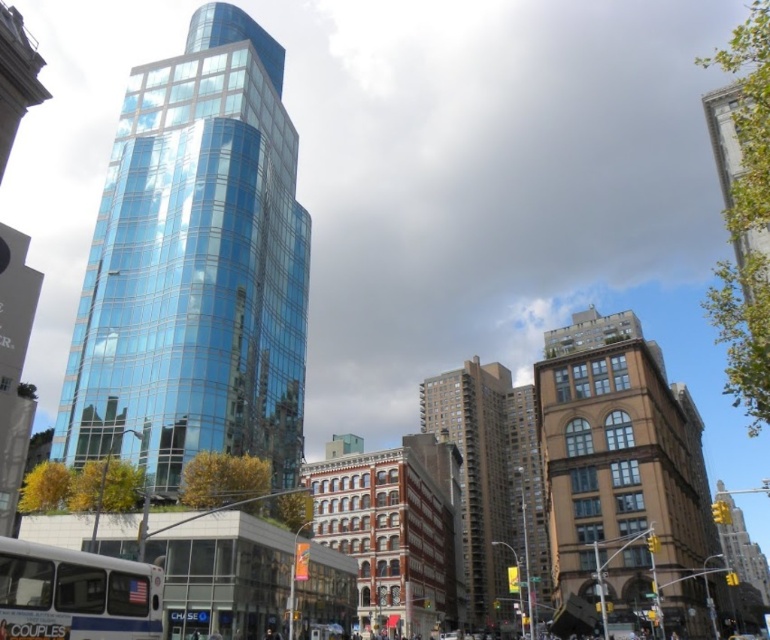
Between white matte bus at lower left and metallic silver car at center, which one appears on the left side from the viewer's perspective?

Positioned to the left is white matte bus at lower left.

Is white matte bus at lower left thinner than metallic silver car at center?

Indeed, white matte bus at lower left has a lesser width compared to metallic silver car at center.

Locate an element on the screen. This screenshot has height=640, width=770. white matte bus at lower left is located at coordinates (75, 595).

This screenshot has width=770, height=640. Identify the location of white matte bus at lower left. (75, 595).